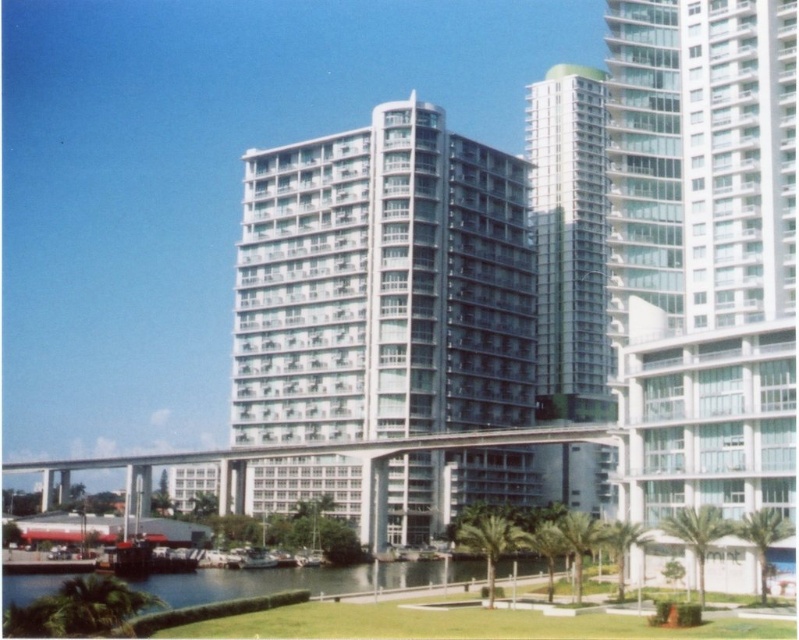
Can you confirm if white glass building at center is positioned above white glassy building at center?

No.

Which of these two, white glass building at center or white glassy building at center, stands shorter?

white glass building at center

Which is in front, point (414, 220) or point (593, 456)?

Point (414, 220) is more forward.

Where is `white glass building at center`? The width and height of the screenshot is (799, 640). white glass building at center is located at coordinates (382, 285).

Who is shorter, clear glass building at right or green grass at lower center?

With less height is green grass at lower center.

Is point (680, 90) in front of point (134, 588)?

No, (680, 90) is behind (134, 588).

What do you see at coordinates (702, 252) in the screenshot?
I see `clear glass building at right` at bounding box center [702, 252].

Locate an element on the screen. clear glass building at right is located at coordinates (702, 252).

Who is higher up, green grass at lower center or metallic silver boat at center?

green grass at lower center is higher up.

Between point (328, 577) and point (261, 566), which one is positioned in front?

Point (328, 577) is more forward.

Find the location of a particular element. Image resolution: width=799 pixels, height=640 pixels. green grass at lower center is located at coordinates (304, 580).